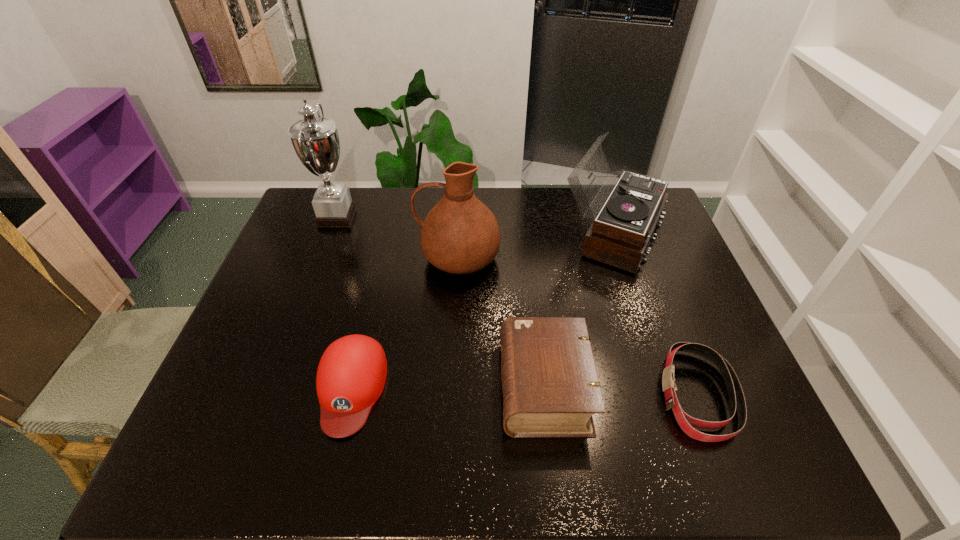
Find the location of a particular element. This screenshot has width=960, height=540. dog collar that is at the near edge is located at coordinates (736, 396).

Identify the location of object at the left edge. The image size is (960, 540). (315, 140).

Locate an element on the screen. The image size is (960, 540). record player present at the right edge is located at coordinates (619, 236).

Find the location of a particular element. The image size is (960, 540). dog collar that is at the right edge is located at coordinates point(736,396).

Where is `object positioned at the far left corner`? object positioned at the far left corner is located at coordinates (315, 140).

Where is `object at the far right corner`? The image size is (960, 540). object at the far right corner is located at coordinates (619, 236).

This screenshot has width=960, height=540. I want to click on object positioned at the near right corner, so point(736,396).

In the image, there is a desktop. Identify the location of vacant space at the far edge. (525, 210).

I want to click on free space at the near edge of the desktop, so click(x=268, y=467).

Find the location of `vacant space at the left edge of the desktop`. vacant space at the left edge of the desktop is located at coordinates (252, 336).